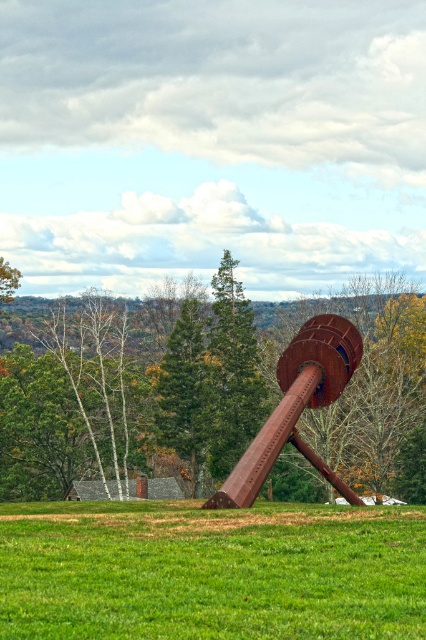
Who is lower down, brown textured tree at center or green grass at lower center?

green grass at lower center is below.

The height and width of the screenshot is (640, 426). What do you see at coordinates (129, 400) in the screenshot?
I see `brown textured tree at center` at bounding box center [129, 400].

Does point (14, 458) come behind point (359, 522)?

Yes, it is.

Find the location of a particular element. The height and width of the screenshot is (640, 426). brown textured tree at center is located at coordinates (129, 400).

Can you confirm if brown textured tree at center is shorter than rusty metal pole at center?

No, brown textured tree at center is not shorter than rusty metal pole at center.

At what (x,y) coordinates should I click in order to perform the action: click on brown textured tree at center. Please return your answer as a coordinate pair (x, y). Image resolution: width=426 pixels, height=640 pixels. Looking at the image, I should click on (129, 400).

This screenshot has width=426, height=640. In order to click on brown textured tree at center in this screenshot , I will do `click(129, 400)`.

Is point (94, 612) in front of point (354, 348)?

Yes, it is in front of point (354, 348).

Is green grass at lower center in front of rusty metal pole at center?

Yes, green grass at lower center is closer to the viewer.

Between point (181, 540) and point (331, 333), which one is positioned in front?

Positioned in front is point (181, 540).

The height and width of the screenshot is (640, 426). Find the location of `green grass at lower center`. green grass at lower center is located at coordinates (210, 572).